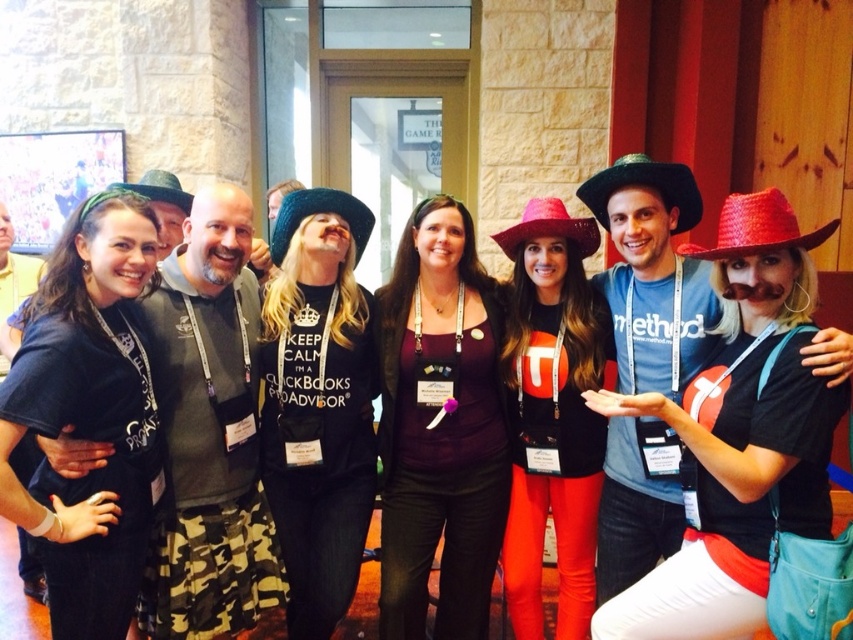
Question: Which object is the farthest from the black felt cowboy hat at upper left?

Choices:
 (A) black knitted cowboy hat at center
 (B) green felt cowboy hat at center

Answer: (B)

Question: From the image, what is the correct spatial relationship of green felt cowboy hat at center in relation to black knitted cowboy hat at center?

Choices:
 (A) right
 (B) left

Answer: (A)

Question: Can you confirm if green felt cowboy hat at center is positioned above red felt cowboy hat at center?

Choices:
 (A) no
 (B) yes

Answer: (B)

Question: Is red straw cowboy hat at upper right closer to camera compared to green felt cowboy hat at center?

Choices:
 (A) yes
 (B) no

Answer: (A)

Question: Which is nearer to the black felt cowboy hat at upper left?

Choices:
 (A) red straw cowboy hat at upper right
 (B) black knitted cowboy hat at center
 (C) green felt cowboy hat at center

Answer: (B)

Question: Which point is closer to the camera taking this photo?

Choices:
 (A) (160, 193)
 (B) (762, 205)

Answer: (B)